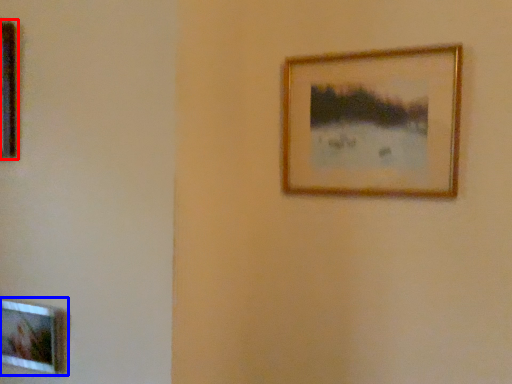
Question: Among these objects, which one is nearest to the camera, picture frame (highlighted by a red box) or picture frame (highlighted by a blue box)?

Choices:
 (A) picture frame
 (B) picture frame

Answer: (A)